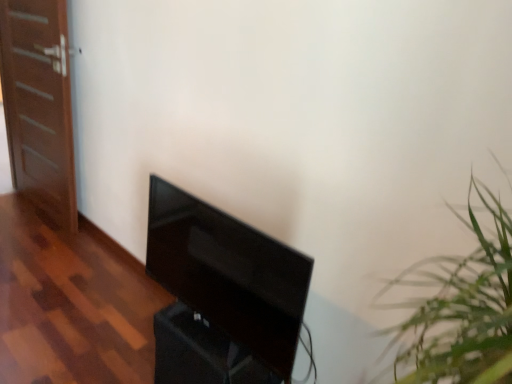
Question: Could you tell me if black glossy tv at center is turned towards brown wooden door at left?

Choices:
 (A) yes
 (B) no

Answer: (B)

Question: From a real-world perspective, is black glossy tv at center positioned over brown wooden door at left based on gravity?

Choices:
 (A) yes
 (B) no

Answer: (B)

Question: Can you confirm if black glossy tv at center is taller than brown wooden door at left?

Choices:
 (A) yes
 (B) no

Answer: (B)

Question: Is black glossy tv at center oriented away from brown wooden door at left?

Choices:
 (A) no
 (B) yes

Answer: (A)

Question: Considering the relative positions of black glossy tv at center and brown wooden door at left in the image provided, is black glossy tv at center to the right of brown wooden door at left from the viewer's perspective?

Choices:
 (A) yes
 (B) no

Answer: (A)

Question: Does black glossy tv at center lie in front of brown wooden door at left?

Choices:
 (A) no
 (B) yes

Answer: (B)

Question: Is brown wooden door at left outside of black glossy tv at center?

Choices:
 (A) yes
 (B) no

Answer: (A)

Question: Is brown wooden door at left facing towards black glossy tv at center?

Choices:
 (A) no
 (B) yes

Answer: (A)

Question: Is brown wooden door at left positioned in front of black glossy tv at center?

Choices:
 (A) yes
 (B) no

Answer: (B)

Question: Is brown wooden door at left taller than black glossy tv at center?

Choices:
 (A) no
 (B) yes

Answer: (B)

Question: Is brown wooden door at left behind black glossy tv at center?

Choices:
 (A) no
 (B) yes

Answer: (B)

Question: Is black glossy tv at center a part of brown wooden door at left?

Choices:
 (A) yes
 (B) no

Answer: (B)

Question: Does point (220, 278) appear closer or farther from the camera than point (38, 144)?

Choices:
 (A) closer
 (B) farther

Answer: (A)